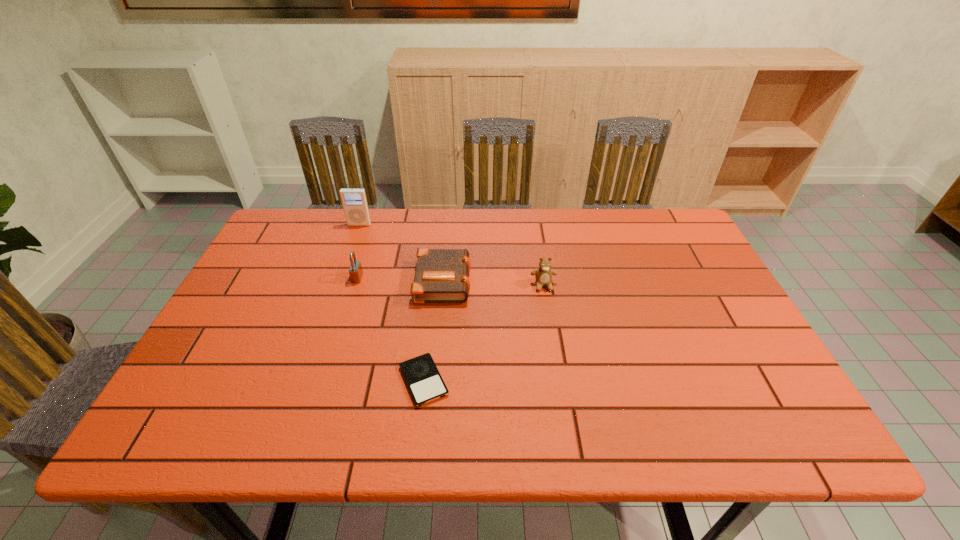
Locate an element on the screen. This screenshot has width=960, height=540. vacant space situated on the spine side of the second shortest object is located at coordinates (549, 279).

Identify the location of free space located 0.090m on the right of the right iPod. (491, 381).

The image size is (960, 540). I want to click on object at the far edge, so click(x=354, y=201).

The height and width of the screenshot is (540, 960). What are the coordinates of `object at the near edge` in the screenshot? It's located at (422, 377).

I want to click on vacant region at the far edge of the desktop, so click(x=554, y=218).

Locate an element on the screen. The height and width of the screenshot is (540, 960). vacant area at the near edge of the desktop is located at coordinates (274, 428).

Find the location of `vacant space at the left edge of the desktop`. vacant space at the left edge of the desktop is located at coordinates (247, 276).

This screenshot has width=960, height=540. In the image, there is a desktop. Find the location of `free space at the right edge`. free space at the right edge is located at coordinates (735, 379).

At what (x,y) coordinates should I click in order to perform the action: click on free spot at the far left corner of the desktop. Please return your answer as a coordinate pair (x, y). The image size is (960, 540). Looking at the image, I should click on (290, 245).

Identify the location of vacant space at the far right corner. (684, 245).